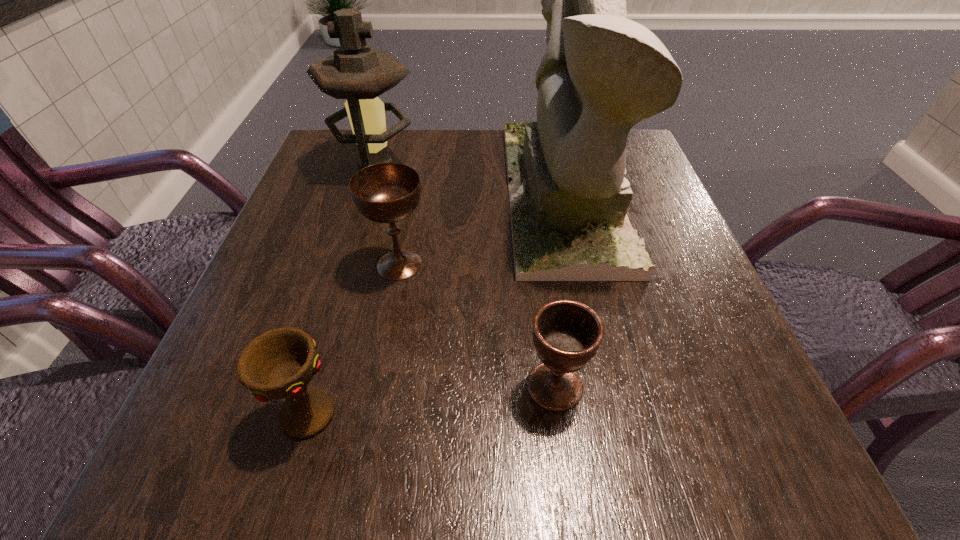
Locate an element on the screen. The height and width of the screenshot is (540, 960). blank area located 0.230m on the right of the rightmost chalice is located at coordinates (749, 386).

Identify the location of sculpture present at the far edge. The height and width of the screenshot is (540, 960). (601, 73).

Where is `oil lamp at the far edge`? oil lamp at the far edge is located at coordinates (356, 72).

What are the coordinates of `object located at the near edge` in the screenshot? It's located at (280, 363).

The width and height of the screenshot is (960, 540). I want to click on oil lamp located at the left edge, so click(x=356, y=72).

At what (x,y) coordinates should I click in order to perform the action: click on chalice that is at the left edge. Please return your answer as a coordinate pair (x, y). The image size is (960, 540). Looking at the image, I should click on (280, 363).

Locate an element on the screen. The height and width of the screenshot is (540, 960). object located at the right edge is located at coordinates (601, 73).

Where is `object positioned at the far left corner`? object positioned at the far left corner is located at coordinates (356, 72).

Locate an element on the screen. object at the near left corner is located at coordinates (280, 363).

Find the location of `object present at the far right corner`. object present at the far right corner is located at coordinates (601, 73).